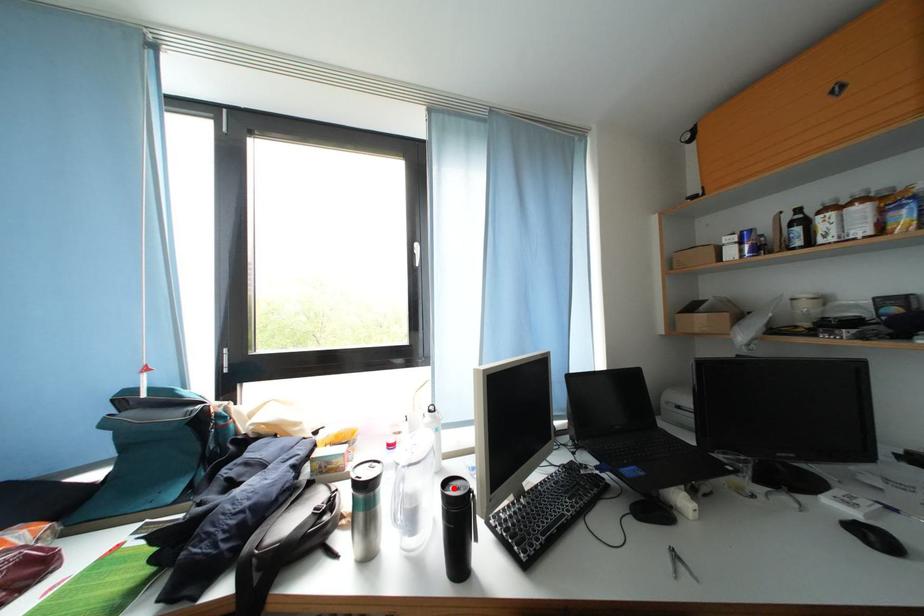
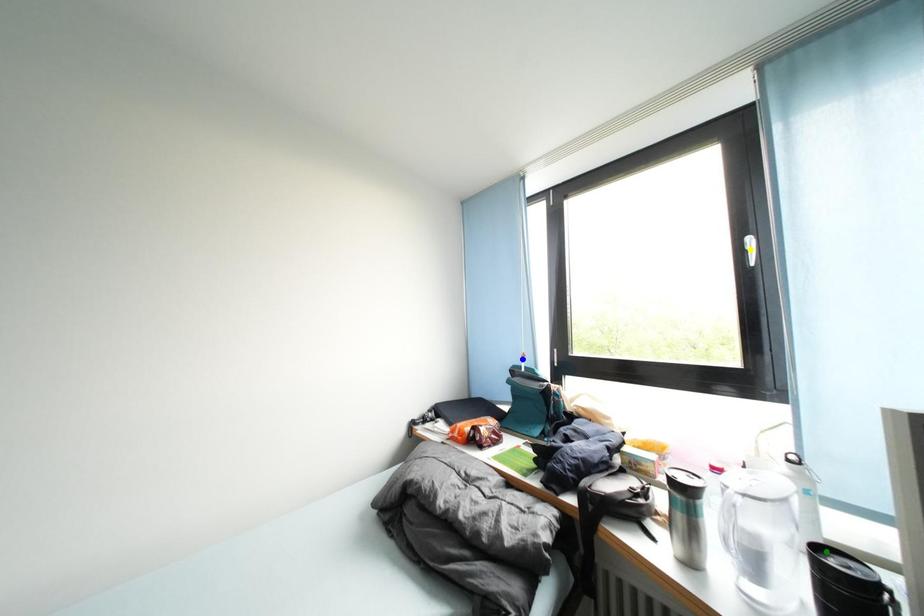
Question: I am providing you with two images of the same scene from different viewpoints. A red point is marked on the first image. You are given multiple points on the second image. Which point in image 2 is actually the same real-world point as the red point in image 1?

Choices:
 (A) green point
 (B) yellow point
 (C) blue point

Answer: (A)